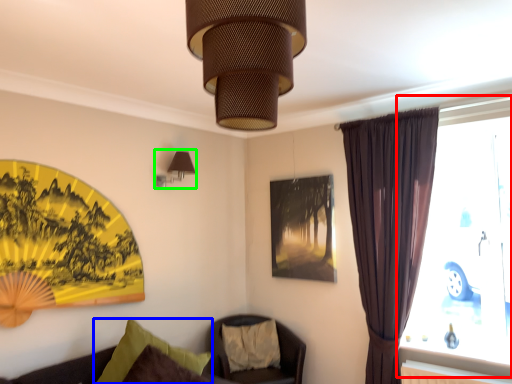
Question: Which object is the closest to the window (highlighted by a red box)? Choose among these: pillow (highlighted by a blue box) or lamp (highlighted by a green box).

Choices:
 (A) pillow
 (B) lamp

Answer: (A)